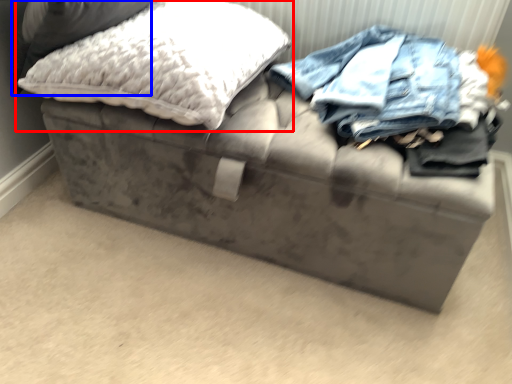
Question: Among these objects, which one is farthest to the camera, pillow (highlighted by a red box) or pillow (highlighted by a blue box)?

Choices:
 (A) pillow
 (B) pillow

Answer: (A)